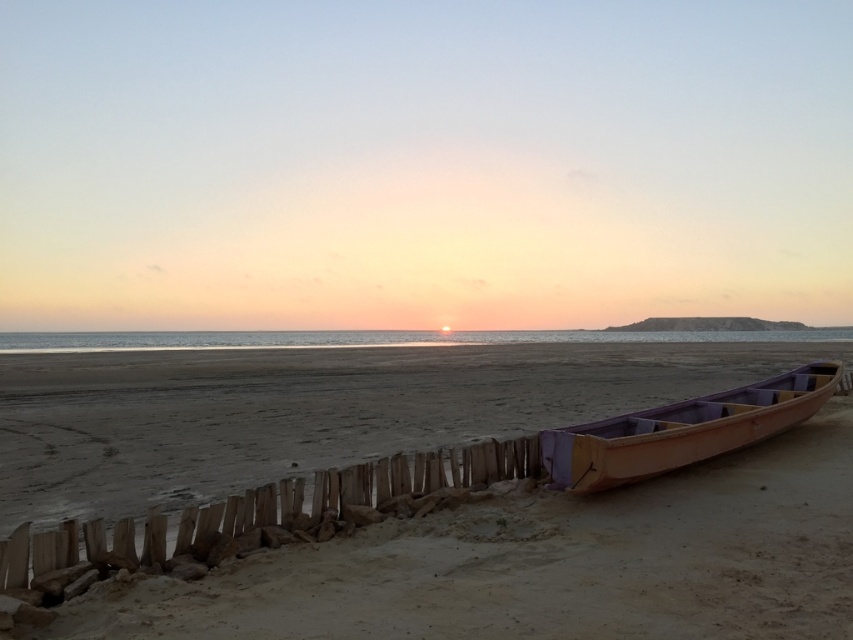
Question: In this image, where is wooden boat at lower right located relative to wooden canoe at right?

Choices:
 (A) left
 (B) right

Answer: (A)

Question: Which point appears farthest from the camera in this image?

Choices:
 (A) (759, 408)
 (B) (91, 360)

Answer: (B)

Question: Considering the relative positions of wooden boat at lower right and wooden canoe at right in the image provided, where is wooden boat at lower right located with respect to wooden canoe at right?

Choices:
 (A) above
 (B) below

Answer: (B)

Question: Observing the image, what is the correct spatial positioning of wooden boat at lower right in reference to wooden canoe at right?

Choices:
 (A) below
 (B) above

Answer: (A)

Question: Among these objects, which one is nearest to the camera?

Choices:
 (A) wooden boat at lower right
 (B) wooden canoe at right

Answer: (A)